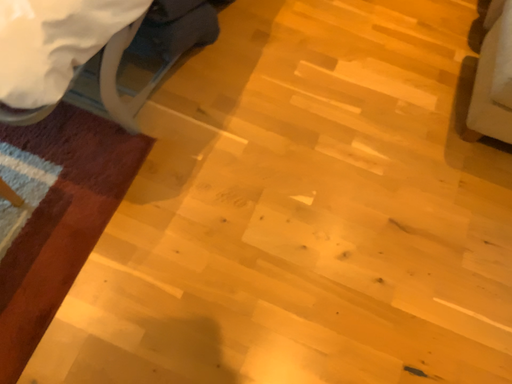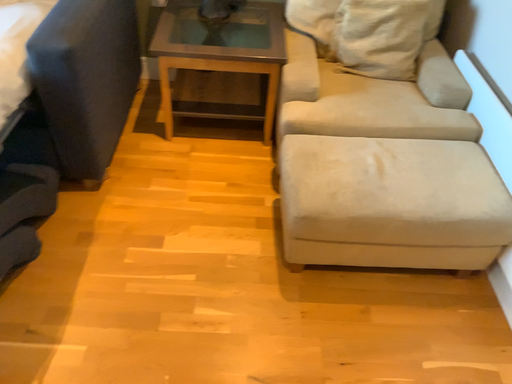
Question: How did the camera likely rotate when shooting the video?

Choices:
 (A) rotated left
 (B) rotated right

Answer: (B)